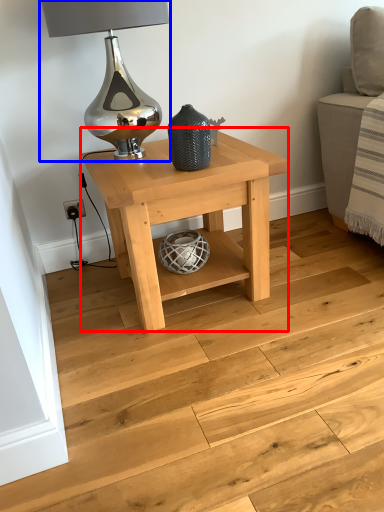
Question: Which object appears closest to the camera in this image, table (highlighted by a red box) or table lamp (highlighted by a blue box)?

Choices:
 (A) table
 (B) table lamp

Answer: (B)